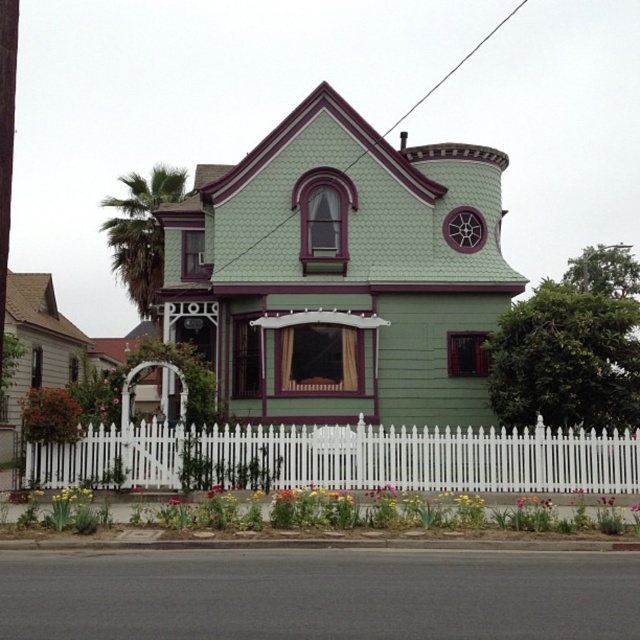
You are standing in front of the house and want to walk to the green leafy palm tree at left. Which direction should you move relative to the white picket fence at lower center?

You should move to the left of the white picket fence at lower center to reach the green leafy palm tree at left.

Looking at this image, you are standing in front of the Victorian house and notice two points marked on its facade. The first point is at coordinates point (156, 486) and the second is at point (120, 243). Which of these two points is closer to you as you stand facing the house?

Point (156, 486) is in front of point (120, 243), so it is closer to you as you face the house.